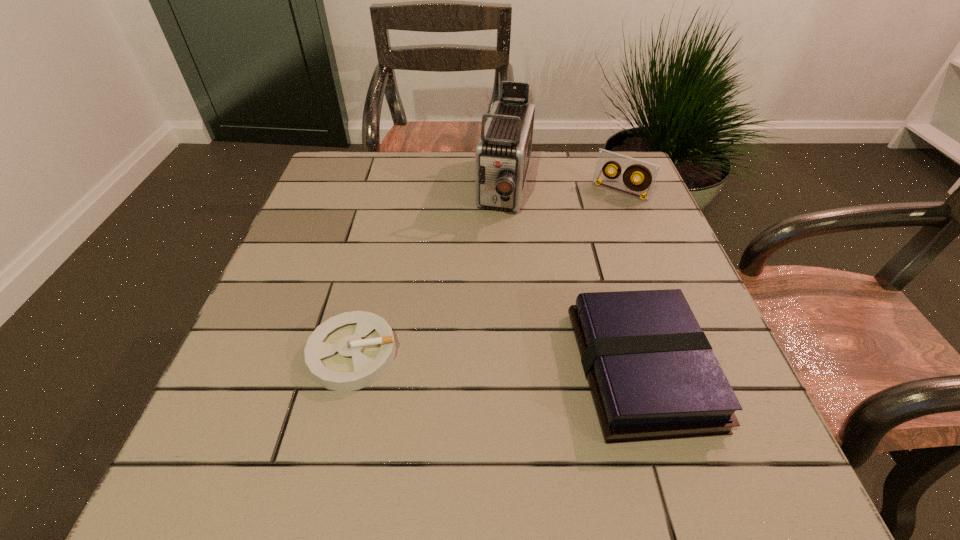
This screenshot has height=540, width=960. I want to click on free space on the desktop that is between the shortest object and the book and is positioned at the lens of the camcorder, so click(459, 359).

You are a GUI agent. You are given a task and a screenshot of the screen. Output one action in this format:
    pyautogui.click(x=<x>, y=<y>)
    Task: Click on the free space on the desktop that is between the ashtray and the second shortest object and is positioned at the front of the videotape with visible reels
    This screenshot has width=960, height=540.
    Given the screenshot: What is the action you would take?
    pyautogui.click(x=493, y=361)